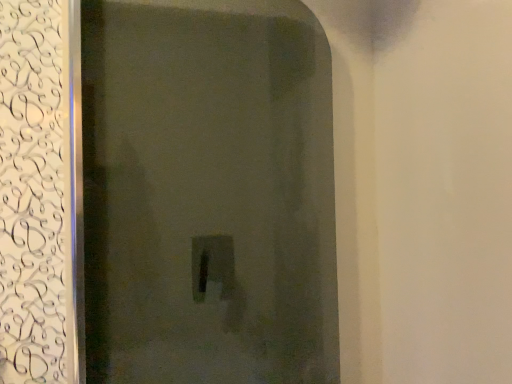
Describe the element at coordinates (208, 193) in the screenshot. This screenshot has height=384, width=512. I see `transparent glass door at center` at that location.

Locate an element on the screen. This screenshot has height=384, width=512. transparent glass door at center is located at coordinates (208, 193).

This screenshot has height=384, width=512. What are the coordinates of `transparent glass door at center` in the screenshot? It's located at (208, 193).